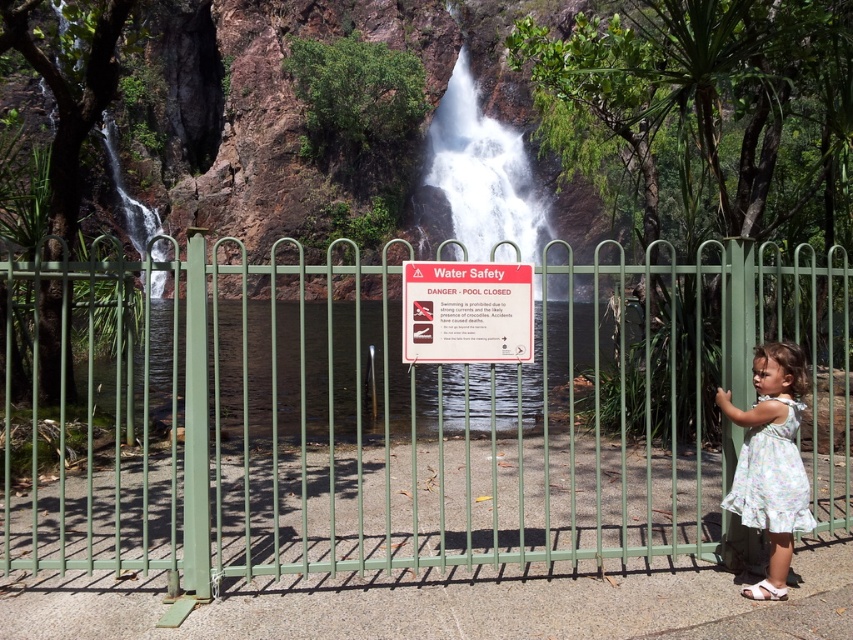
You are a park visitor who wants to get closer to the waterfall. You see the green metal fence at center and the red plastic sign at center. Which object is closer to the left side of the image?

The green metal fence at center is closer to the left side of the image because it is to the left of the red plastic sign at center.

You are a park ranger who needs to ensure visitor safety. You observe a visitor wearing a floral dress at center standing near the green metal fence. The white frothy water at center is visible in the background. Given the distance between them, can the visitor safely approach the fence to read the warning sign without risking slipping into the water?

The distance between the white frothy water at center and the floral dress at center is 21.48 meters. Since the visitor is already near the fence, which is likely positioned at a safe distance from the water, they can safely approach the fence to read the warning sign without any risk of slipping into the water.